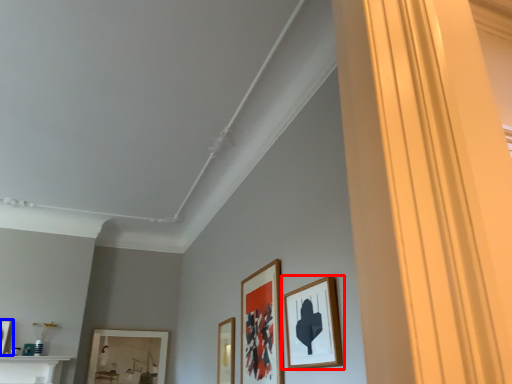
Question: Which point is further to the camera, picture frame (highlighted by a red box) or picture frame (highlighted by a blue box)?

Choices:
 (A) picture frame
 (B) picture frame

Answer: (B)